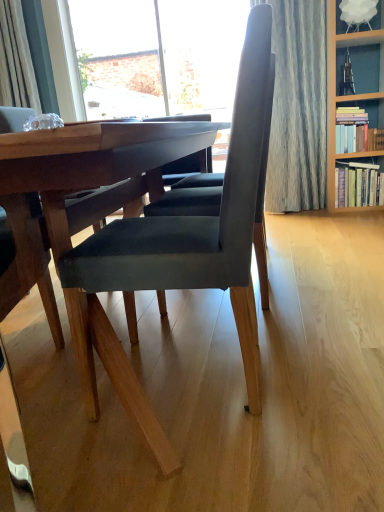
Locate an element on the screen. The width and height of the screenshot is (384, 512). free space in front of velvet dark gray chair at center is located at coordinates (205, 464).